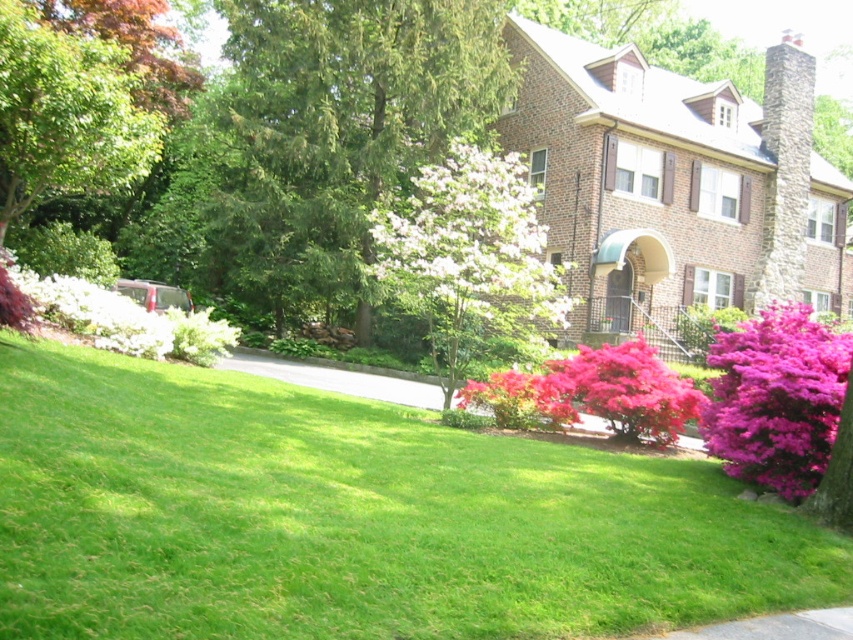
Looking at this image, you are standing on the lawn and want to walk from the green leafy tree at upper left to the purple velvet bush at lower right. Which direction should you head to reach the bush?

You should head downward from the green leafy tree at upper left to reach the purple velvet bush at lower right since the tree is located above the bush.

You are standing at the entrance of the driveway and want to plant a new tree in your yard. The green leafy tree at upper left is already present. Based on its position, where would you place the new tree to ensure it doesn not block the driveway or the house?

The green leafy tree at upper left is located at point (67, 115), so placing the new tree away from this coordinate and ensuring it is not near the driveway or house would be best.

You are standing in the middle of the lawn and want to walk to the white matte flower at center. Which direction should you go to avoid walking through the green textured tree at upper center?

The white matte flower at center is behind the green textured tree at upper center, so you should walk towards the back of the green textured tree at upper center to reach the white matte flower at center without going through it.